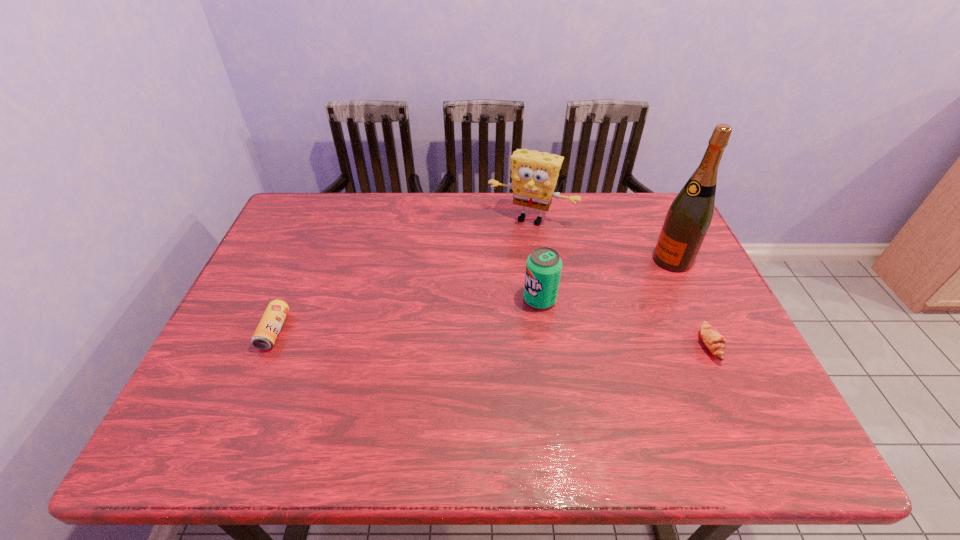
In order to click on vacant spot on the desktop that is between the leftmost object and the shortest object and is positioned on the front-facing side of the pop soda in this screenshot , I will do `click(458, 336)`.

The height and width of the screenshot is (540, 960). I want to click on vacant spot on the desktop that is between the beer can and the pastry and is positioned on the face of the sponge, so click(475, 337).

The image size is (960, 540). Identify the location of free space on the desktop that is between the leftmost object and the shortest object and is positioned on the front-facing side of the fourth nearest object. (531, 339).